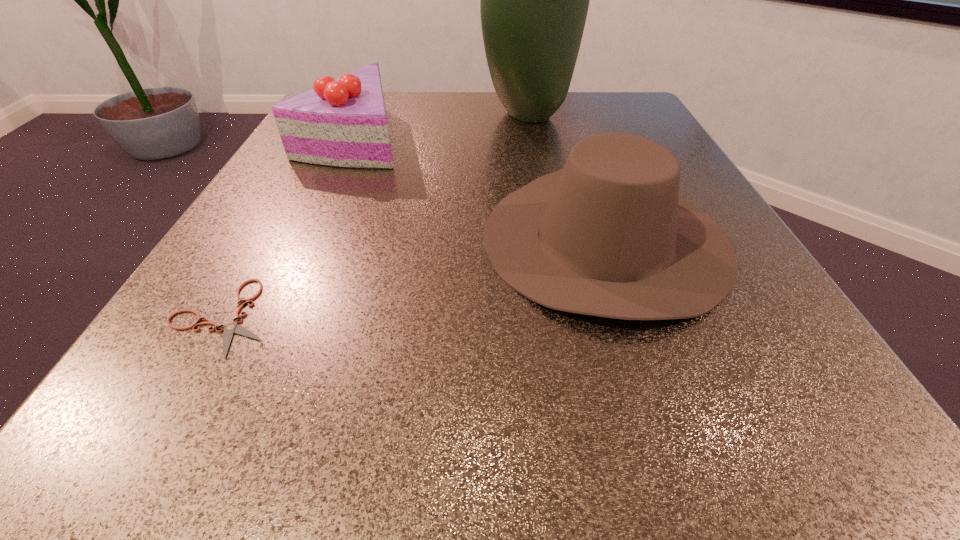
In order to click on cake that is at the left edge in this screenshot , I will do `click(342, 122)`.

This screenshot has width=960, height=540. I want to click on shears at the left edge, so click(229, 329).

Identify the location of object located at the right edge. (607, 235).

Where is `object situated at the far left corner`? This screenshot has height=540, width=960. object situated at the far left corner is located at coordinates (342, 122).

Find the location of a particular element. The width and height of the screenshot is (960, 540). free region at the far edge of the desktop is located at coordinates (482, 127).

Locate an element on the screen. free space at the near edge is located at coordinates (691, 424).

The image size is (960, 540). I want to click on vacant space at the left edge of the desktop, so click(x=270, y=262).

At what (x,y) coordinates should I click in order to perform the action: click on free space at the far right corner of the desktop. Please return your answer as a coordinate pair (x, y). This screenshot has height=540, width=960. Looking at the image, I should click on (605, 105).

Where is `vacant region between the vase and the cake`? This screenshot has height=540, width=960. vacant region between the vase and the cake is located at coordinates (441, 125).

Find the location of a particular element. The width and height of the screenshot is (960, 540). unoccupied area between the tallest object and the cake is located at coordinates point(441,125).